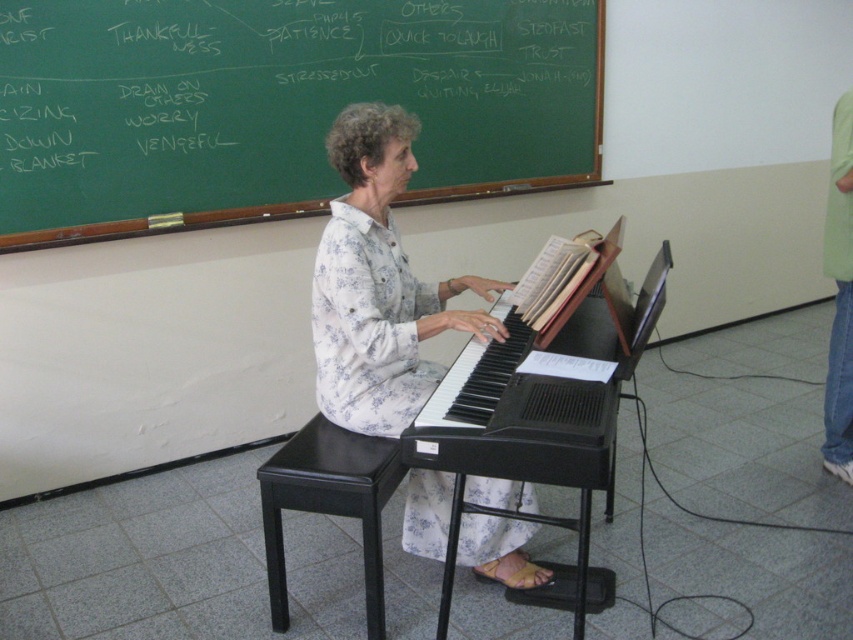
Is point (177, 166) positioned in front of point (434, 371)?

No.

The width and height of the screenshot is (853, 640). Find the location of `green chalkboard at upper center`. green chalkboard at upper center is located at coordinates (277, 104).

Find the location of a particular element. green chalkboard at upper center is located at coordinates (277, 104).

Between point (430, 385) and point (384, 442), which one is positioned behind?

Point (430, 385)

Is white floral shirt at center bigger than black leather stool at lower center?

Yes, white floral shirt at center is bigger than black leather stool at lower center.

Between point (437, 541) and point (366, 586), which one is positioned in front?

Point (366, 586) is more forward.

Where is `white floral shirt at center`? This screenshot has height=640, width=853. white floral shirt at center is located at coordinates (378, 284).

Between point (131, 90) and point (273, 593), which one is positioned behind?

The point (131, 90) is behind.

This screenshot has height=640, width=853. What do you see at coordinates (277, 104) in the screenshot? I see `green chalkboard at upper center` at bounding box center [277, 104].

Does point (509, 124) lie behind point (364, 548)?

Yes, it is.

Find the location of a particular element. The width and height of the screenshot is (853, 640). green chalkboard at upper center is located at coordinates pos(277,104).